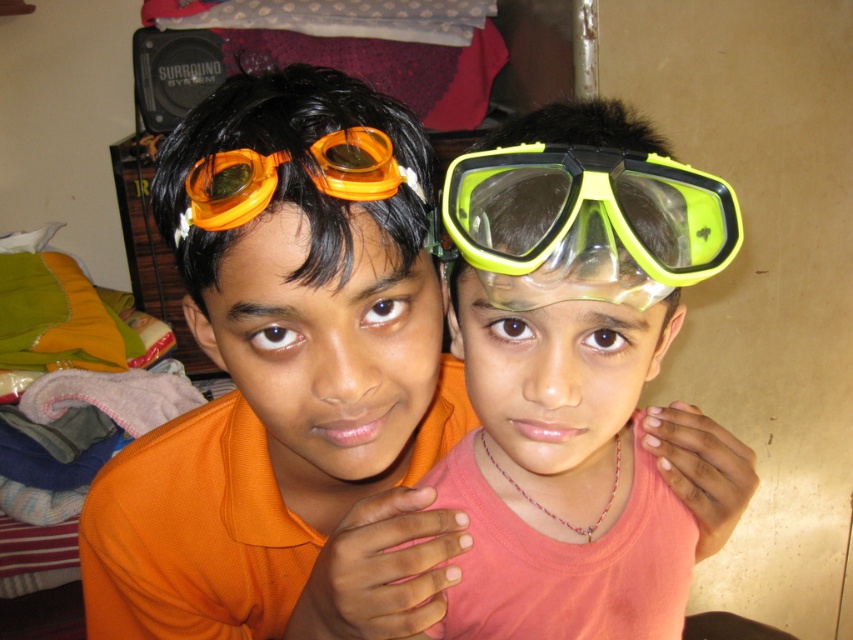
You are standing at point (554, 147) and want to walk to the door located at point (508, 401). Is there a clear path between these two points?

Point (508, 401) is behind point (554, 147), so there is no clear path between them.